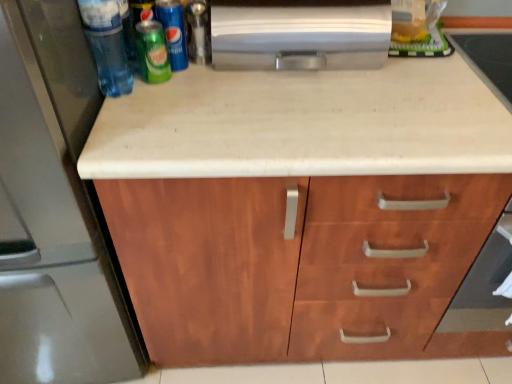
Question: Based on their sizes in the image, would you say green matte soda can at upper left, acting as the first beer starting from the left, is bigger or smaller than green matte pepsi can at upper left, acting as the 1th beer starting from the right?

Choices:
 (A) small
 (B) big

Answer: (A)

Question: From the image's perspective, is green matte soda can at upper left, placed as the 2th beer when sorted from right to left, located above or below green matte pepsi can at upper left, the 2th beer in the left-to-right sequence?

Choices:
 (A) below
 (B) above

Answer: (A)

Question: Which is nearer to the satin metallic refrigerator at left?

Choices:
 (A) silver metallic paper towel holder at upper center
 (B) translucent plastic bottle at upper left
 (C) green matte pepsi can at upper left, the 2th beer in the left-to-right sequence
 (D) green matte soda can at upper left, acting as the first beer starting from the left
 (E) wooden cabinet at center

Answer: (B)

Question: Which of these objects is positioned closest to the silver metallic paper towel holder at upper center?

Choices:
 (A) wooden cabinet at center
 (B) translucent plastic bottle at upper left
 (C) green matte pepsi can at upper left, the 2th beer in the left-to-right sequence
 (D) satin metallic refrigerator at left
 (E) green matte soda can at upper left, acting as the first beer starting from the left

Answer: (C)